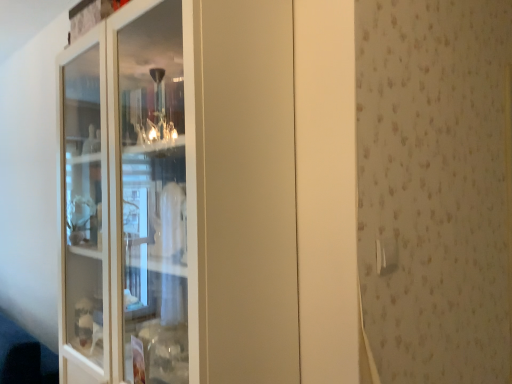
You are a GUI agent. You are given a task and a screenshot of the screen. Output one action in this format:
    pyautogui.click(x=<x>, y=<y>)
    Task: Click on the white glass cabinet at left
    The width and height of the screenshot is (512, 384).
    Given the screenshot: What is the action you would take?
    pyautogui.click(x=179, y=196)

What do you see at coordinates (179, 196) in the screenshot?
I see `white glass cabinet at left` at bounding box center [179, 196].

Image resolution: width=512 pixels, height=384 pixels. What do you see at coordinates (386, 255) in the screenshot? I see `white plastic door handle at upper right` at bounding box center [386, 255].

Where is `white plastic door handle at upper right`? white plastic door handle at upper right is located at coordinates (386, 255).

Locate an element on the screen. The height and width of the screenshot is (384, 512). white glass cabinet at left is located at coordinates (179, 196).

Is white plastic door handle at upper right at the left side of white glass cabinet at left?

No, white plastic door handle at upper right is not to the left of white glass cabinet at left.

Is white plastic door handle at upper right further to the viewer compared to white glass cabinet at left?

Yes, it is behind white glass cabinet at left.

Which is further, (386, 267) or (154, 215)?

Point (154, 215)

From the image's perspective, is white plastic door handle at upper right positioned above or below white glass cabinet at left?

Clearly, from the image's perspective, white plastic door handle at upper right is below white glass cabinet at left.

From a real-world perspective, relative to white glass cabinet at left, is white plastic door handle at upper right vertically above or below?

In terms of real-world spatial position, white plastic door handle at upper right is below white glass cabinet at left.

Considering the sizes of objects white plastic door handle at upper right and white glass cabinet at left in the image provided, who is wider, white plastic door handle at upper right or white glass cabinet at left?

white glass cabinet at left.

Which of these two, white plastic door handle at upper right or white glass cabinet at left, stands taller?

white glass cabinet at left is taller.

Who is bigger, white plastic door handle at upper right or white glass cabinet at left?

white glass cabinet at left.

Is white glass cabinet at left completely or partially inside white plastic door handle at upper right?

No, white glass cabinet at left is not inside white plastic door handle at upper right.

Would you say white plastic door handle at upper right is a long distance from white glass cabinet at left?

No, white plastic door handle at upper right is in close proximity to white glass cabinet at left.

Does white plastic door handle at upper right turn towards white glass cabinet at left?

No, white plastic door handle at upper right is not oriented towards white glass cabinet at left.

How many degrees apart are the facing directions of white plastic door handle at upper right and white glass cabinet at left?

There is a 88.2-degree angle between the facing directions of white plastic door handle at upper right and white glass cabinet at left.

Locate an element on the screen. Image resolution: width=512 pixels, height=384 pixels. cupboard above the white plastic door handle at upper right (from the image's perspective) is located at coordinates (179, 196).

Considering the positions of objects white glass cabinet at left and white plastic door handle at upper right in the image provided, who is more to the left, white glass cabinet at left or white plastic door handle at upper right?

white glass cabinet at left is more to the left.

Does white glass cabinet at left come in front of white plastic door handle at upper right?

That is True.

Does point (248, 265) come in front of point (385, 254)?

That is True.

From the image's perspective, which is below, white glass cabinet at left or white plastic door handle at upper right?

white plastic door handle at upper right.

From a real-world perspective, is white glass cabinet at left physically above white plastic door handle at upper right?

Correct, in the physical world, white glass cabinet at left is higher than white plastic door handle at upper right.

In terms of width, does white glass cabinet at left look wider or thinner when compared to white plastic door handle at upper right?

Clearly, white glass cabinet at left has more width compared to white plastic door handle at upper right.

Can you confirm if white glass cabinet at left is shorter than white plastic door handle at upper right?

Incorrect, the height of white glass cabinet at left does not fall short of that of white plastic door handle at upper right.

Consider the image. Can you confirm if white glass cabinet at left is smaller than white plastic door handle at upper right?

Actually, white glass cabinet at left might be larger than white plastic door handle at upper right.

Is white glass cabinet at left not inside white plastic door handle at upper right?

Absolutely, white glass cabinet at left is external to white plastic door handle at upper right.

Is white glass cabinet at left not close to white plastic door handle at upper right?

No, white glass cabinet at left is not far away from white plastic door handle at upper right.

Is white glass cabinet at left oriented towards white plastic door handle at upper right?

No, white glass cabinet at left does not turn towards white plastic door handle at upper right.

What's the angular difference between white glass cabinet at left and white plastic door handle at upper right's facing directions?

The angular difference between white glass cabinet at left and white plastic door handle at upper right is 88.2 degrees.

Locate an element on the screen. Image resolution: width=512 pixels, height=384 pixels. cupboard in front of the white plastic door handle at upper right is located at coordinates pos(179,196).

Find the location of a particular element. Image resolution: width=512 pixels, height=384 pixels. door handle below the white glass cabinet at left (from a real-world perspective) is located at coordinates (386, 255).

The height and width of the screenshot is (384, 512). Find the location of `door handle that appears behind the white glass cabinet at left`. door handle that appears behind the white glass cabinet at left is located at coordinates (386, 255).